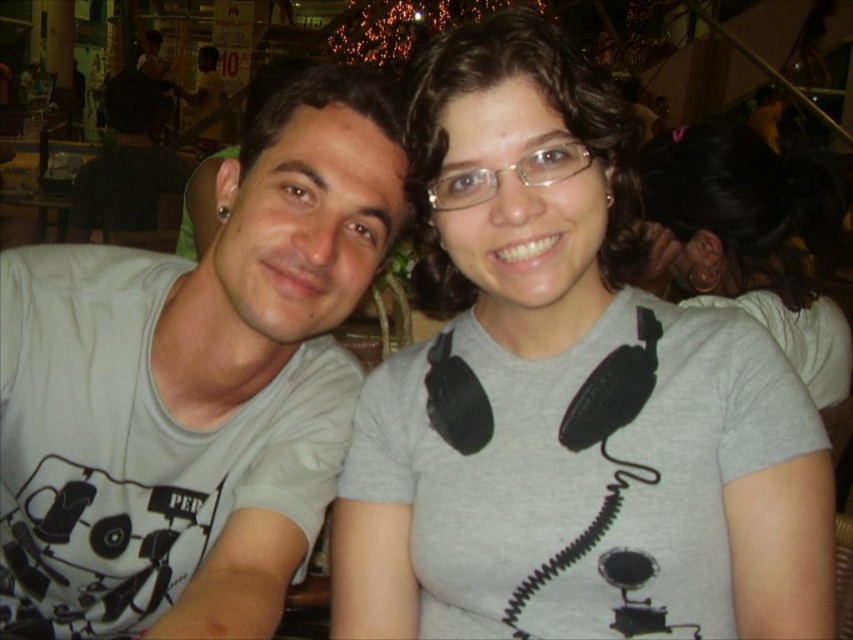
Question: Does white matte t-shirt at left come behind black matte shirt at left?

Choices:
 (A) yes
 (B) no

Answer: (B)

Question: Which of these objects is positioned farthest from the gray matte headphones at center?

Choices:
 (A) black matte shirt at left
 (B) white matte t-shirt at left
 (C) gray matte t-shirt at center

Answer: (A)

Question: Where is gray matte t-shirt at center located in relation to white matte t-shirt at left in the image?

Choices:
 (A) right
 (B) left

Answer: (A)

Question: Estimate the real-world distances between objects in this image. Which object is farther from the black matte shirt at left?

Choices:
 (A) gray matte t-shirt at center
 (B) white matte t-shirt at left
 (C) gray matte headphones at center

Answer: (A)

Question: Does white matte t-shirt at left appear on the left side of gray matte headphones at center?

Choices:
 (A) no
 (B) yes

Answer: (B)

Question: Which object is farther from the camera taking this photo?

Choices:
 (A) black matte shirt at left
 (B) white matte t-shirt at left
 (C) gray matte t-shirt at center

Answer: (A)